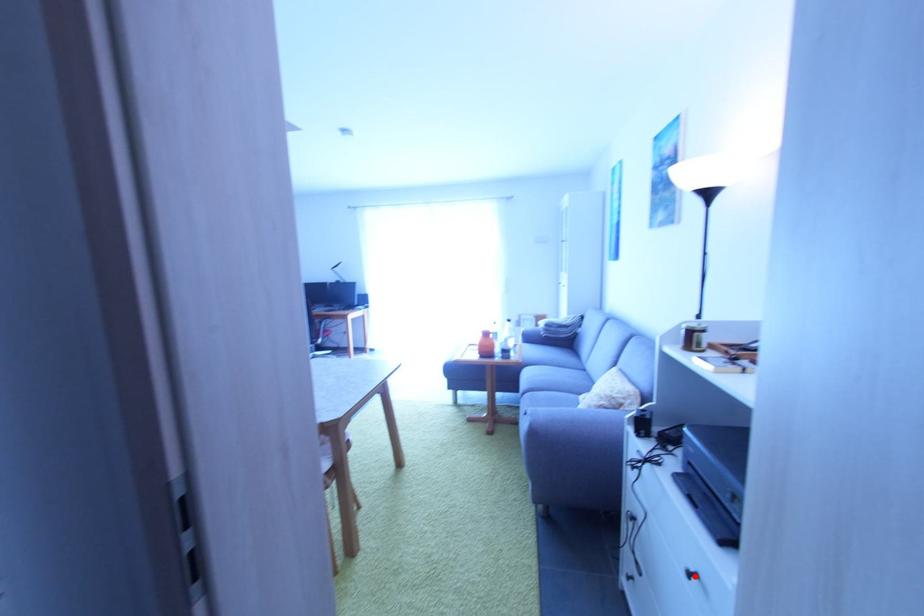
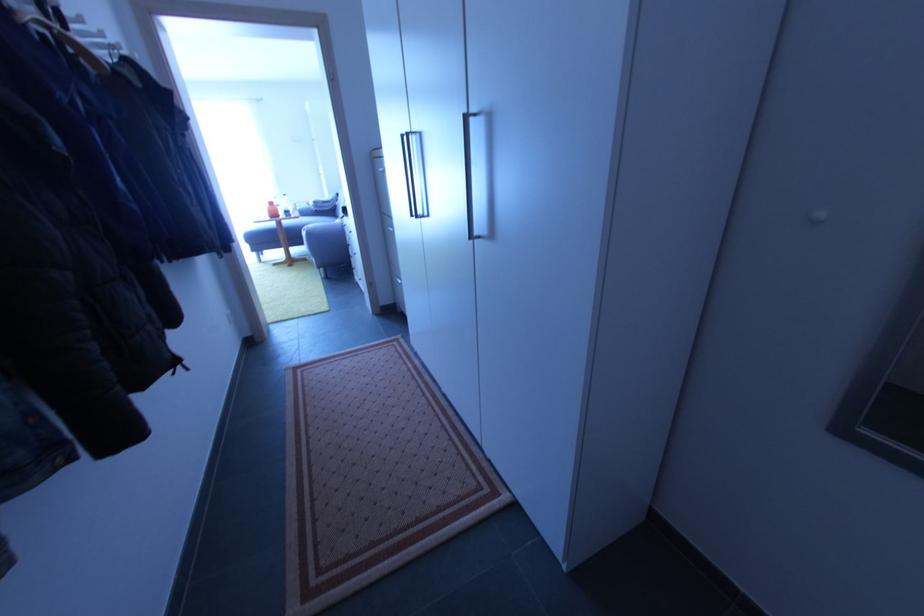
Question: I am providing you with two images of the same scene from different viewpoints. A red point is marked on the first image. At the location where the point appears in image 1, is it still visible in image 2?

Choices:
 (A) Yes
 (B) No

Answer: (B)